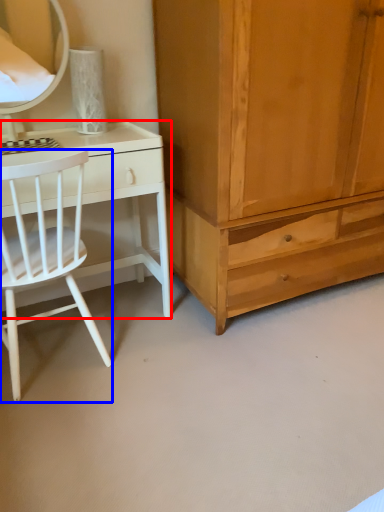
Question: Among these objects, which one is nearest to the camera, desk (highlighted by a red box) or chair (highlighted by a blue box)?

Choices:
 (A) desk
 (B) chair

Answer: (B)